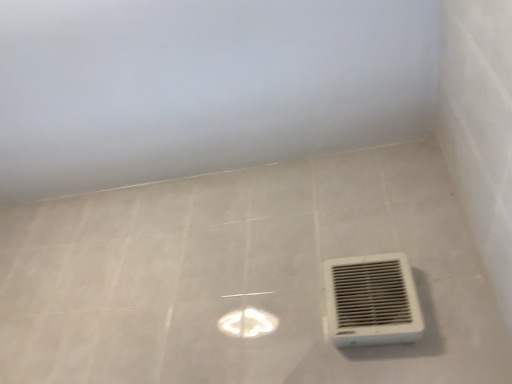
The image size is (512, 384). What are the coordinates of `white plastic vent at lower right` in the screenshot? It's located at (372, 301).

Describe the element at coordinates (372, 301) in the screenshot. I see `white plastic vent at lower right` at that location.

This screenshot has height=384, width=512. Identify the location of white plastic vent at lower right. (372, 301).